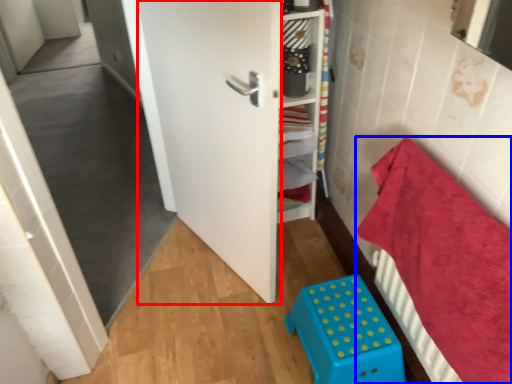
Question: Among these objects, which one is farthest to the camera, door (highlighted by a red box) or bedding (highlighted by a blue box)?

Choices:
 (A) door
 (B) bedding

Answer: (A)